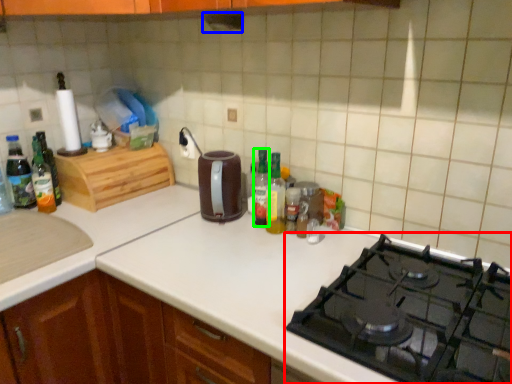
Question: Which is nearer to the gas stove (highlighted by a red box)? exhaust hood (highlighted by a blue box) or bottle (highlighted by a green box).

Choices:
 (A) exhaust hood
 (B) bottle

Answer: (B)